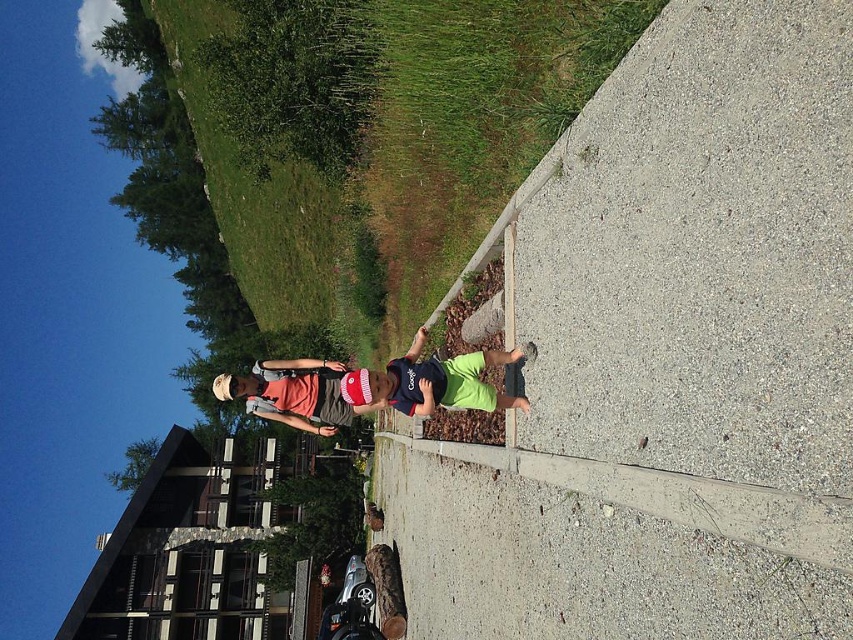
Question: Which of these objects is positioned closest to the matte red cap at center?

Choices:
 (A) gray concrete at center
 (B) dark blue jersey at center

Answer: (B)

Question: Does gray concrete at center have a lesser width compared to matte red cap at center?

Choices:
 (A) no
 (B) yes

Answer: (B)

Question: Is gray concrete at center to the left of matte red cap at center from the viewer's perspective?

Choices:
 (A) no
 (B) yes

Answer: (A)

Question: Which point is farther from the camera taking this photo?

Choices:
 (A) (746, 621)
 (B) (303, 369)

Answer: (B)

Question: Observing the image, what is the correct spatial positioning of gray concrete at center in reference to dark blue jersey at center?

Choices:
 (A) right
 (B) left

Answer: (A)

Question: Which of the following is the closest to the observer?

Choices:
 (A) (671, 253)
 (B) (274, 374)
 (C) (376, 385)

Answer: (A)